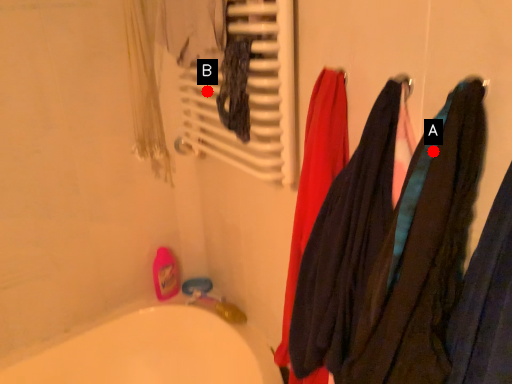
Question: Two points are circled on the image, labeled by A and B beside each circle. Which point appears closest to the camera in this image?

Choices:
 (A) A is closer
 (B) B is closer

Answer: (A)